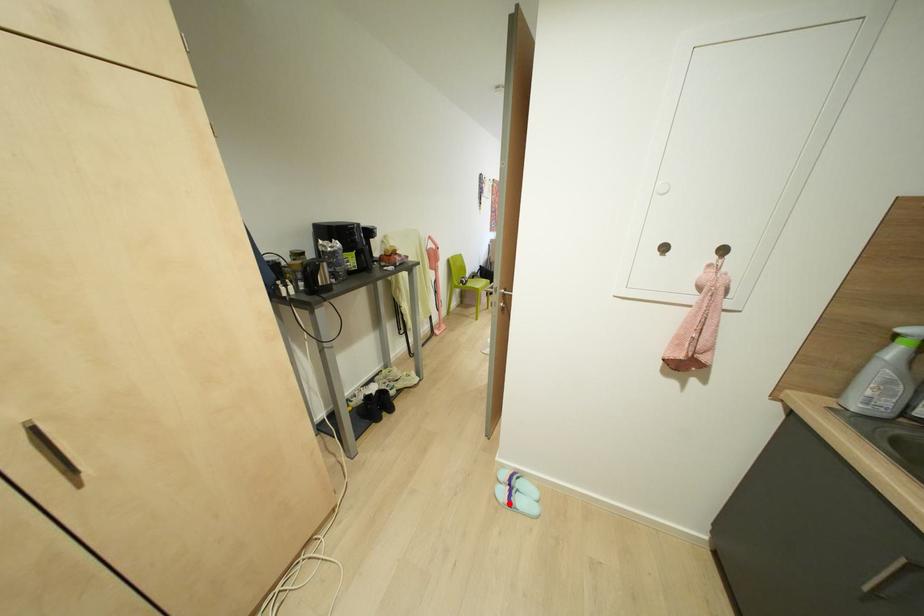
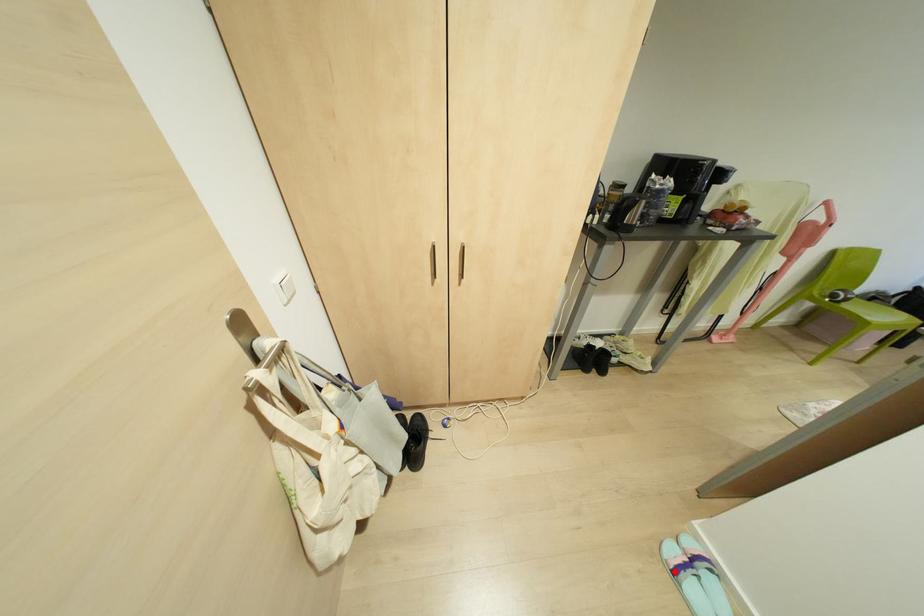
Looking at this image, I am providing you with two images of the same scene from different viewpoints. A red point is marked on the first image and another point is marked on the second image. Is the marked point in image1 the same physical position as the marked point in image2?

Yes